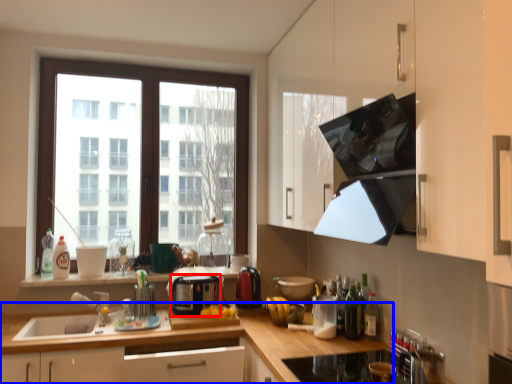
Question: Which point is closer to the camera, appliance (highlighted by a red box) or cabinetry (highlighted by a blue box)?

Choices:
 (A) appliance
 (B) cabinetry

Answer: (B)